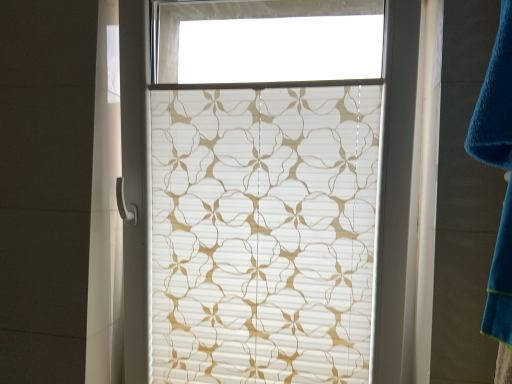
Question: Is translucent beige floral-patterned window blind at center in front of or behind blue soft towel at right in the image?

Choices:
 (A) behind
 (B) front

Answer: (A)

Question: Is point (221, 360) closer or farther from the camera than point (484, 144)?

Choices:
 (A) closer
 (B) farther

Answer: (B)

Question: Considering the positions of translucent beige floral-patterned window blind at center and blue soft towel at right in the image, is translucent beige floral-patterned window blind at center wider or thinner than blue soft towel at right?

Choices:
 (A) wide
 (B) thin

Answer: (A)

Question: Considering the positions of blue soft towel at right and translucent beige floral-patterned window blind at center in the image, is blue soft towel at right wider or thinner than translucent beige floral-patterned window blind at center?

Choices:
 (A) thin
 (B) wide

Answer: (A)

Question: From a real-world perspective, is blue soft towel at right positioned above or below translucent beige floral-patterned window blind at center?

Choices:
 (A) above
 (B) below

Answer: (A)

Question: Considering the positions of point (500, 62) and point (164, 130), is point (500, 62) closer or farther from the camera than point (164, 130)?

Choices:
 (A) closer
 (B) farther

Answer: (A)

Question: Which is correct: blue soft towel at right is inside translucent beige floral-patterned window blind at center, or outside of it?

Choices:
 (A) inside
 (B) outside

Answer: (B)